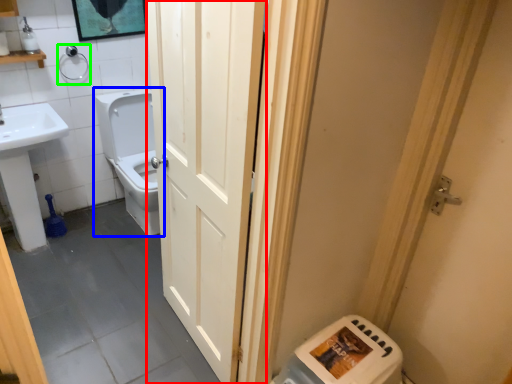
Question: Which object is positioned closest to door (highlighted by a red box)? Select from toilet (highlighted by a blue box) and towel bar (highlighted by a green box).

Choices:
 (A) toilet
 (B) towel bar

Answer: (A)